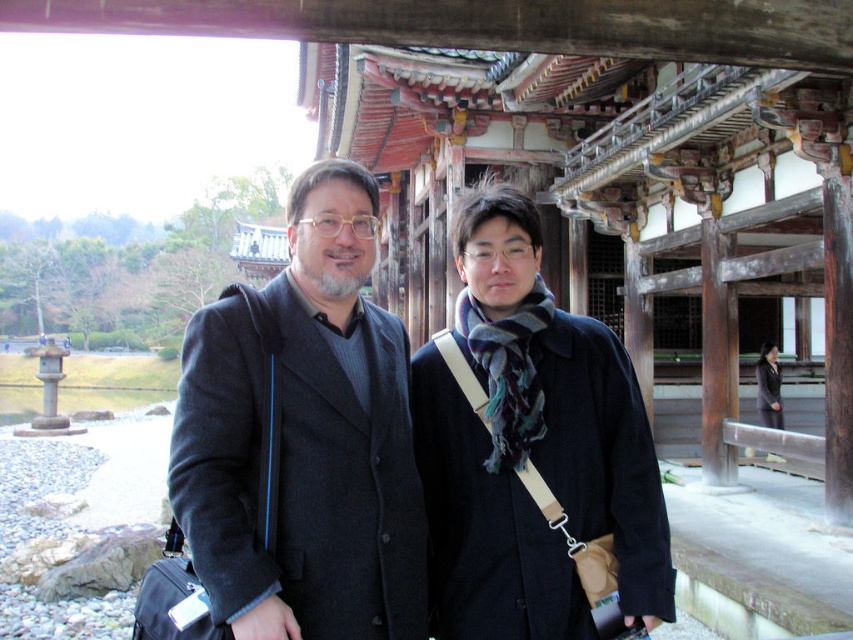
Question: Does dark gray wool coat at center come behind black fabric coat at right?

Choices:
 (A) no
 (B) yes

Answer: (A)

Question: Can you confirm if dark gray wool coat at center is smaller than black fabric coat at right?

Choices:
 (A) yes
 (B) no

Answer: (B)

Question: Is dark gray wool coat at center bigger than black fabric coat at right?

Choices:
 (A) yes
 (B) no

Answer: (A)

Question: Which point is farther to the camera?

Choices:
 (A) (756, 369)
 (B) (339, 179)

Answer: (A)

Question: Which point is farther to the camera?

Choices:
 (A) (280, 616)
 (B) (766, 369)

Answer: (B)